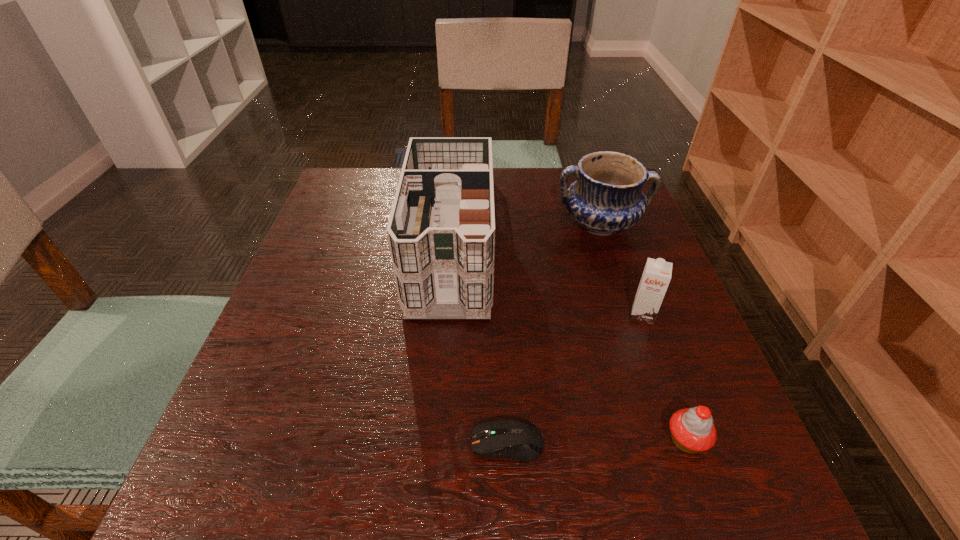
What are the coordinates of `vacant space situated 0.370m on the button of the computer equipment` in the screenshot? It's located at (231, 443).

Where is `free spot located on the button of the computer equipment`? The height and width of the screenshot is (540, 960). free spot located on the button of the computer equipment is located at coordinates (316, 443).

The image size is (960, 540). I want to click on dollhouse present at the far edge, so click(441, 231).

Where is `pottery situated at the far edge`? pottery situated at the far edge is located at coordinates (607, 197).

I want to click on cupcake that is positioned at the near edge, so tap(692, 430).

Where is `computer equipment situated at the near edge`? The height and width of the screenshot is (540, 960). computer equipment situated at the near edge is located at coordinates (515, 439).

This screenshot has width=960, height=540. What are the coordinates of `pottery at the right edge` in the screenshot? It's located at (607, 197).

Find the location of a particular element. The image size is (960, 540). chocolate milk that is at the right edge is located at coordinates (656, 276).

Identify the location of cupcake situated at the right edge. The height and width of the screenshot is (540, 960). (692, 430).

Where is `object present at the far right corner`? The height and width of the screenshot is (540, 960). object present at the far right corner is located at coordinates (607, 197).